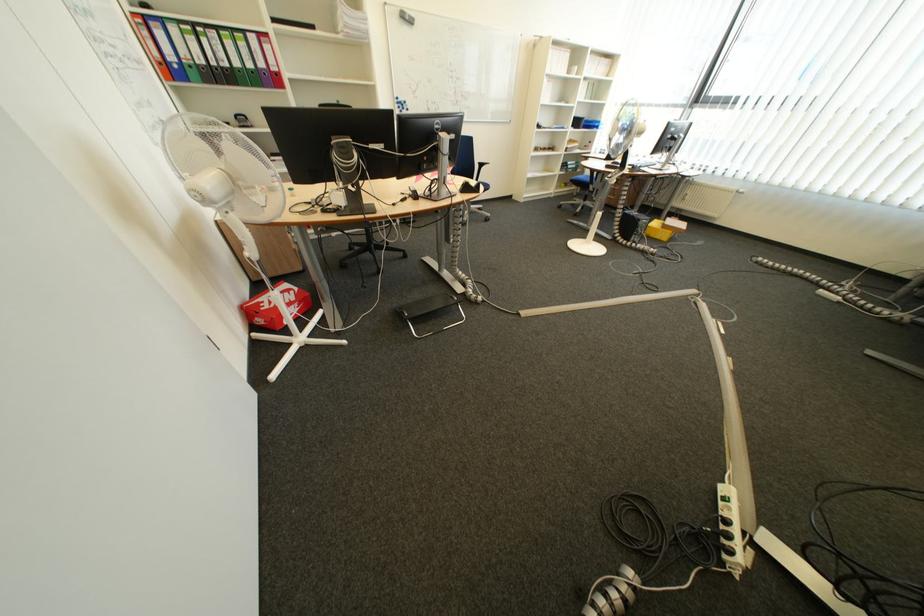
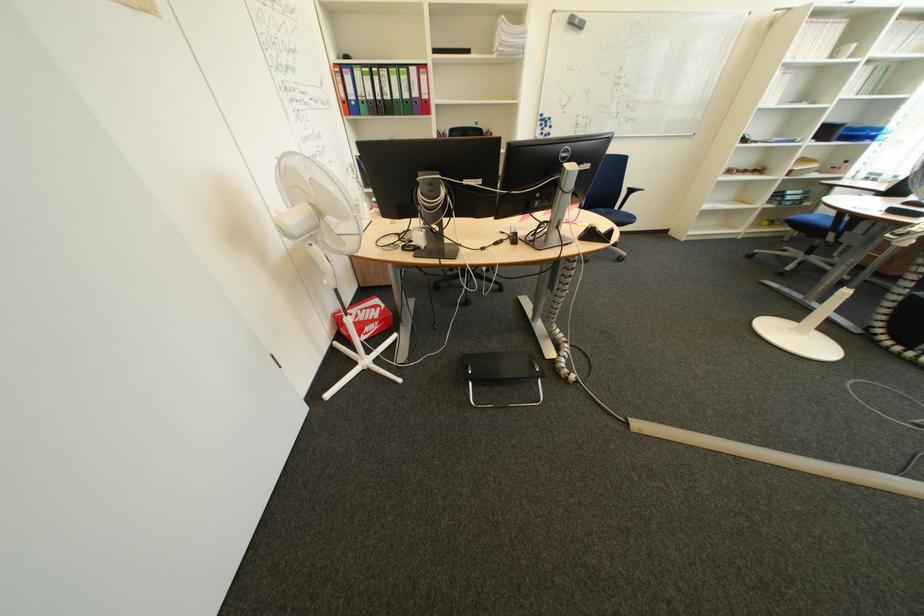
Locate, in the second image, the point that corresponds to (x=383, y=148) in the first image.

(479, 184)